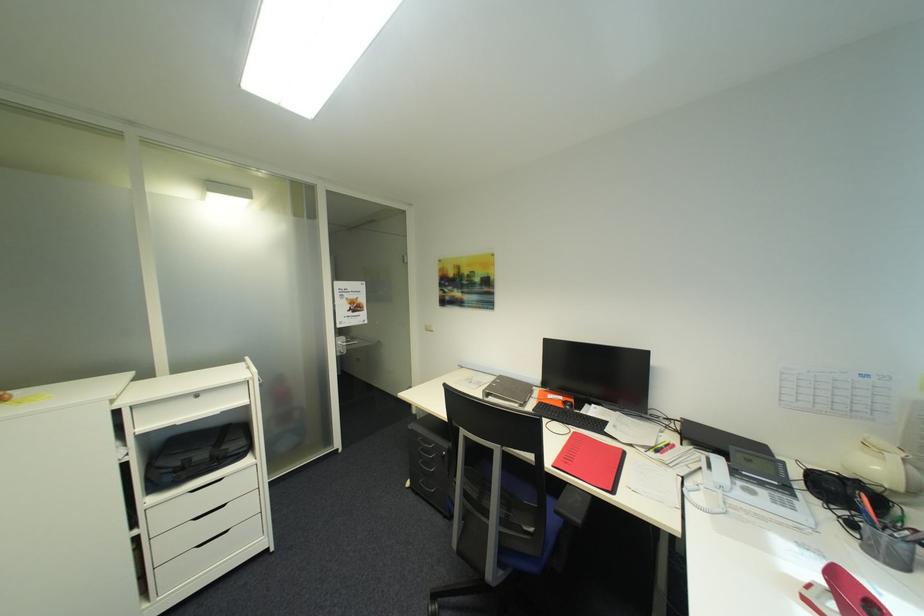
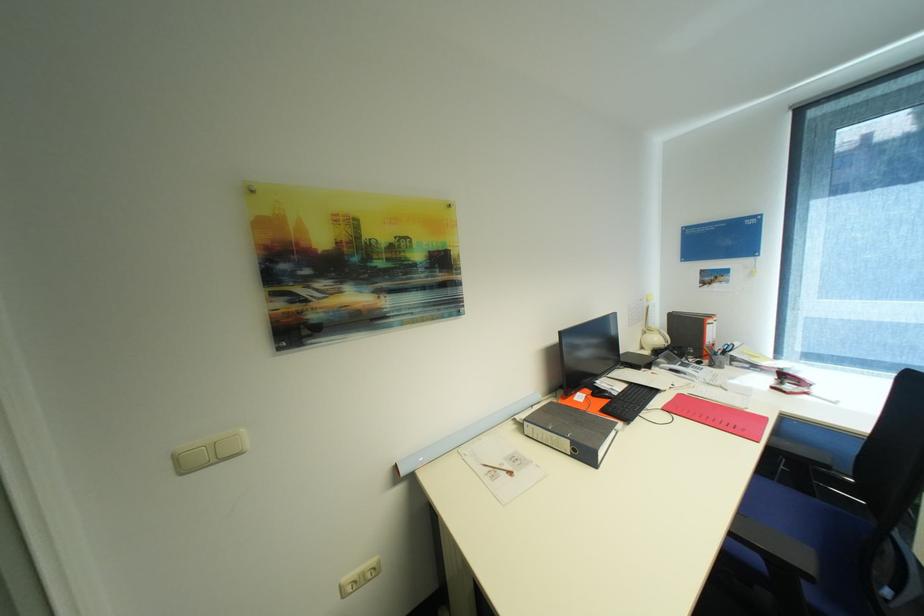
The point at (886,469) is marked in the first image. Where is the corresponding point in the second image?

(663, 339)